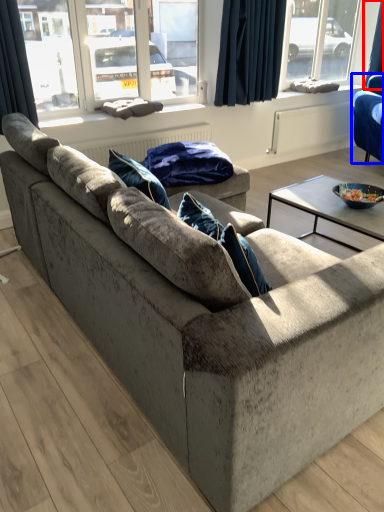
Question: Which of the following is the farthest to the observer, curtain (highlighted by a red box) or studio couch (highlighted by a blue box)?

Choices:
 (A) curtain
 (B) studio couch

Answer: (A)